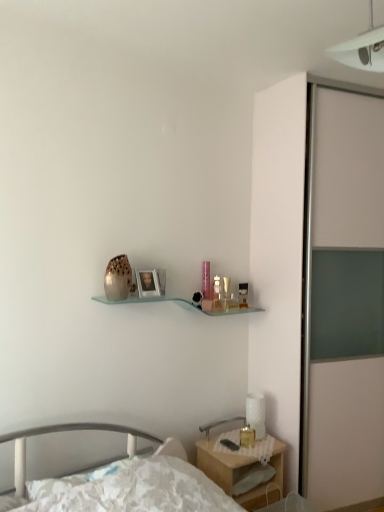
You are a GUI agent. You are given a task and a screenshot of the screen. Output one action in this format:
    pyautogui.click(x=<x>, y=<y>)
    Task: Click on the empty space that is ontop of wooden nightstand at lower right (from a real-world perspective)
    Image resolution: width=384 pixels, height=512 pixels.
    Given the screenshot: What is the action you would take?
    pyautogui.click(x=245, y=440)